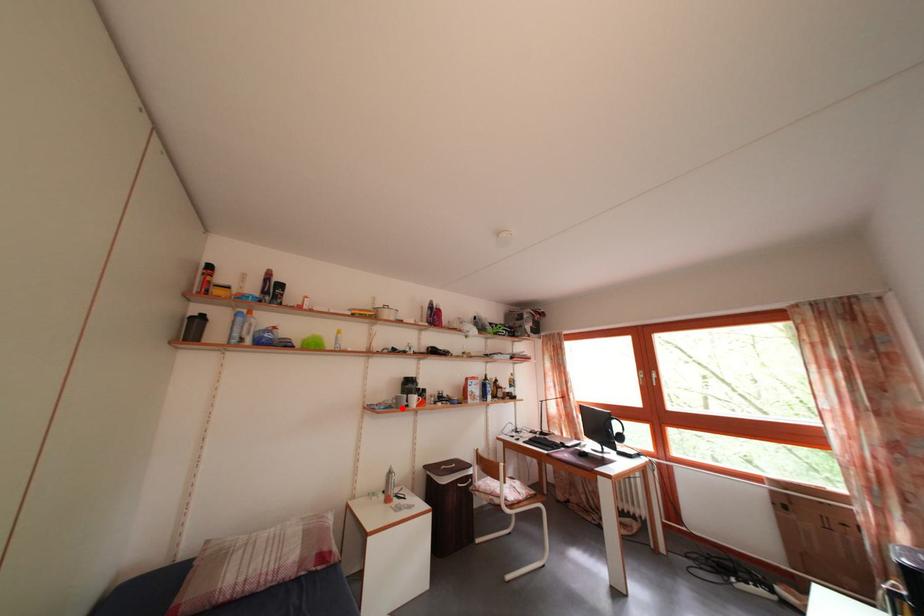
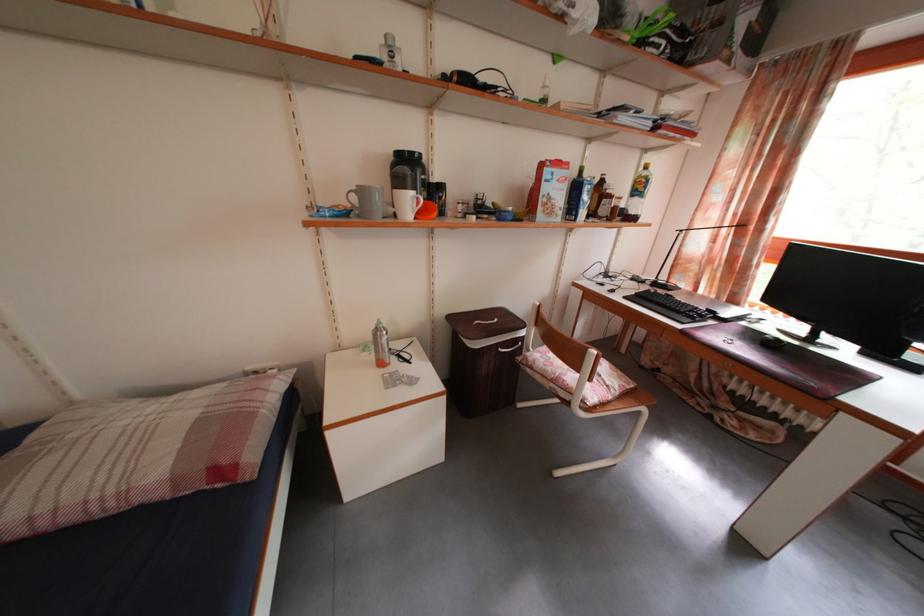
Question: I am providing you with two images of the same scene from different viewpoints. Image1 has a red point marked. In image2, the corresponding 3D location appears at what relative position? Reply with the corresponding letter.

Choices:
 (A) Closer
 (B) Farther

Answer: (A)